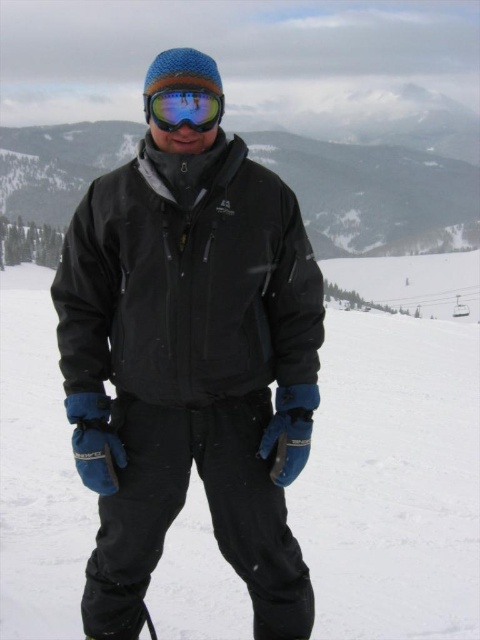
You are a photographer trying to capture the reflection of the glossy plastic goggles at center in the white matte snow at center. Can you see the reflection clearly?

The white matte snow at center is positioned on the left side of glossy plastic goggles at center. Since the snow is matte, it does not reflect light well, so the reflection of the glossy plastic goggles at center would not be clear.

You are a photographer trying to capture the person in the scene. Since both the black softshell jacket at center and the glossy plastic goggles at center are at the center, which one should you focus on first if you want to ensure the upper part of the person is in focus?

The glossy plastic goggles at center are above the black softshell jacket at center, so focusing on the glossy plastic goggles at center first would ensure the upper part of the person is in focus.